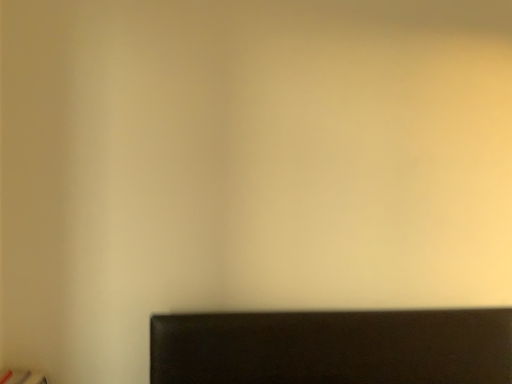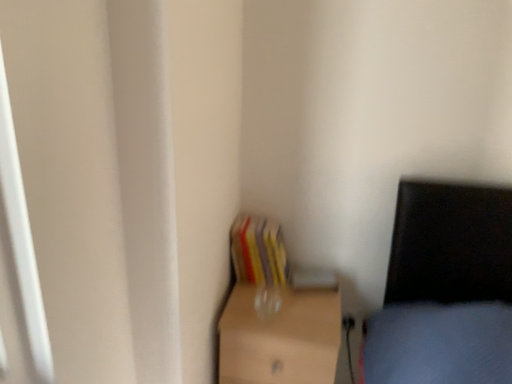
Question: How did the camera likely rotate when shooting the video?

Choices:
 (A) rotated left
 (B) rotated right

Answer: (A)